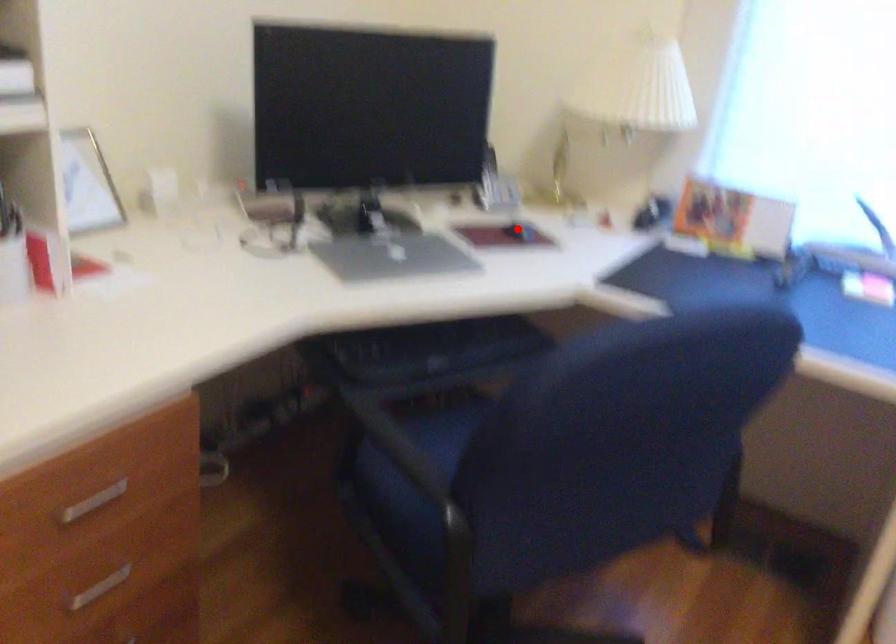
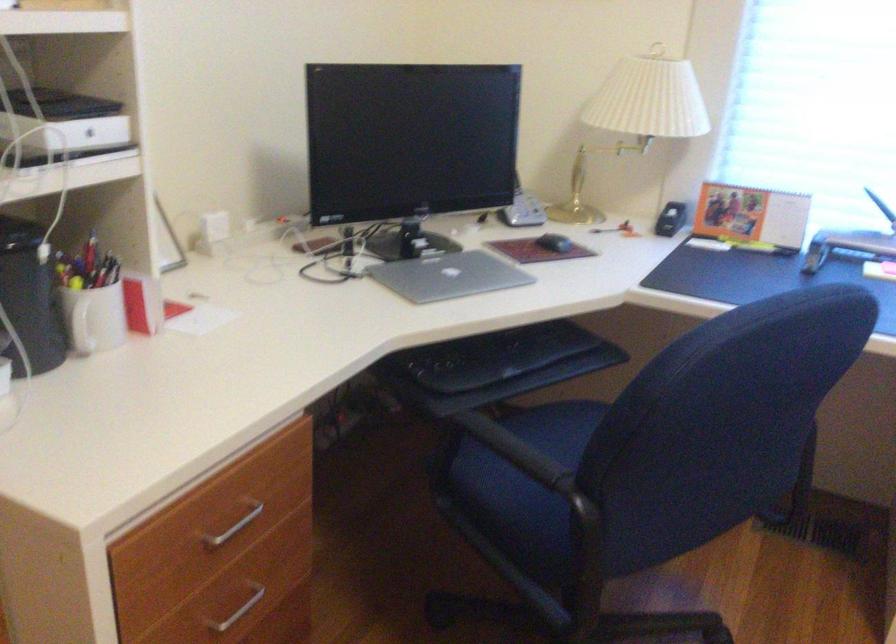
The point at the highlighted location is marked in the first image. Where is the corresponding point in the second image?

(554, 243)